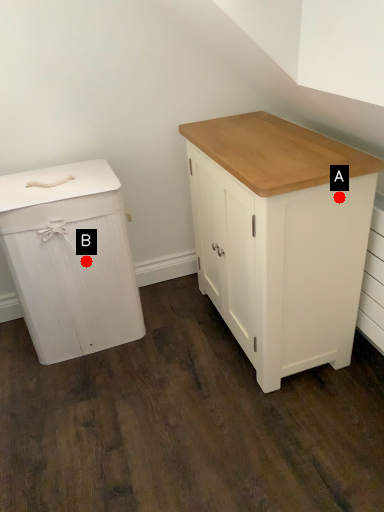
Question: Two points are circled on the image, labeled by A and B beside each circle. Which point is closer to the camera taking this photo?

Choices:
 (A) A is closer
 (B) B is closer

Answer: (A)